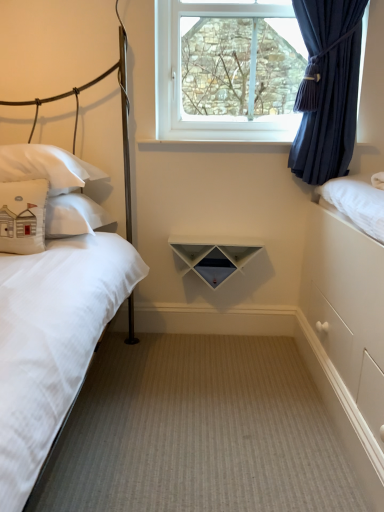
The height and width of the screenshot is (512, 384). What are the coordinates of `white matte triangle at center` in the screenshot? It's located at (214, 256).

What is the approximate width of white matte bed at left?

The width of white matte bed at left is 5.27 feet.

Describe the element at coordinates (46, 167) in the screenshot. I see `white cotton pillow at left, marked as the first pillow in a back-to-front arrangement` at that location.

Image resolution: width=384 pixels, height=512 pixels. Find the location of `navy blue sheer curtain at upper right`. navy blue sheer curtain at upper right is located at coordinates (327, 88).

Measure the distance between beige fabric pillow at left, which is the first pillow in front-to-back order, and camera.

The depth of beige fabric pillow at left, which is the first pillow in front-to-back order, is 1.44 meters.

The width and height of the screenshot is (384, 512). What are the coordinates of `beige fabric pillow at left, which is the first pillow in front-to-back order` in the screenshot? It's located at (23, 216).

Image resolution: width=384 pixels, height=512 pixels. Describe the element at coordinates (227, 70) in the screenshot. I see `clear glass window at upper center` at that location.

At what (x,y) coordinates should I click in order to perform the action: click on white matte triangle at center. Please return your answer as a coordinate pair (x, y). This screenshot has width=384, height=512. Looking at the image, I should click on (214, 256).

Considering the positions of points (109, 403) and (336, 137), is point (109, 403) farther from camera compared to point (336, 137)?

That is False.

In the image, is beige carpet at center positioned in front of or behind navy blue sheer curtain at upper right?

In the image, beige carpet at center appears in front of navy blue sheer curtain at upper right.

In the scene shown: Would you consider beige carpet at center to be distant from navy blue sheer curtain at upper right?

Indeed, beige carpet at center is not near navy blue sheer curtain at upper right.

Image resolution: width=384 pixels, height=512 pixels. Find the location of `plain located below the navy blue sheer curtain at upper right (from the image's perspective)`. plain located below the navy blue sheer curtain at upper right (from the image's perspective) is located at coordinates (198, 432).

From the image's perspective, relative to beige fabric pillow at left, which is the first pillow in front-to-back order, is beige carpet at center above or below?

From the image's perspective, beige carpet at center appears below beige fabric pillow at left, which is the first pillow in front-to-back order.

Is beige carpet at center further to the viewer compared to beige fabric pillow at left, the second pillow positioned from the back?

That is False.

Considering the positions of points (183, 464) and (21, 190), is point (183, 464) closer to camera compared to point (21, 190)?

That is True.

From a real-world perspective, does beige carpet at center stand above beige fabric pillow at left, the second pillow positioned from the back?

No.

How much distance is there between beige carpet at center and white cotton pillow at left, marked as the first pillow in a back-to-front arrangement?

They are 37.44 inches apart.

Identify the location of plain that appears in front of the white cotton pillow at left, marked as the first pillow in a back-to-front arrangement. The image size is (384, 512). (198, 432).

Is beige carpet at center positioned before white cotton pillow at left, arranged as the 2th pillow when viewed from the front?

Yes, the depth of beige carpet at center is less than that of white cotton pillow at left, arranged as the 2th pillow when viewed from the front.

Can you tell me how much beige carpet at center and white cotton pillow at left, marked as the first pillow in a back-to-front arrangement, differ in facing direction?

beige carpet at center and white cotton pillow at left, marked as the first pillow in a back-to-front arrangement, are facing 0.429 degrees away from each other.

Based on the photo, is beige fabric pillow at left, the second pillow positioned from the back, at the right side of navy blue sheer curtain at upper right?

Incorrect, beige fabric pillow at left, the second pillow positioned from the back, is not on the right side of navy blue sheer curtain at upper right.

Considering the relative sizes of beige fabric pillow at left, which is the first pillow in front-to-back order, and navy blue sheer curtain at upper right in the image provided, is beige fabric pillow at left, which is the first pillow in front-to-back order, shorter than navy blue sheer curtain at upper right?

Indeed, beige fabric pillow at left, which is the first pillow in front-to-back order, has a lesser height compared to navy blue sheer curtain at upper right.

Is beige fabric pillow at left, the second pillow positioned from the back, bigger than navy blue sheer curtain at upper right?

A: Actually, beige fabric pillow at left, the second pillow positioned from the back, might be smaller than navy blue sheer curtain at upper right.

How far apart are beige fabric pillow at left, the second pillow positioned from the back, and navy blue sheer curtain at upper right?

beige fabric pillow at left, the second pillow positioned from the back, and navy blue sheer curtain at upper right are 3.91 feet apart.

Can you tell me how much navy blue sheer curtain at upper right and clear glass window at upper center differ in facing direction?

They differ by 1.7 degrees in their facing directions.

Considering the sizes of navy blue sheer curtain at upper right and clear glass window at upper center in the image, is navy blue sheer curtain at upper right bigger or smaller than clear glass window at upper center?

Considering their sizes, navy blue sheer curtain at upper right takes up more space than clear glass window at upper center.

Is navy blue sheer curtain at upper right behind clear glass window at upper center?

No, the depth of navy blue sheer curtain at upper right is less than that of clear glass window at upper center.

Based on the photo, is navy blue sheer curtain at upper right wider than clear glass window at upper center?

Indeed, navy blue sheer curtain at upper right has a greater width compared to clear glass window at upper center.

Can you confirm if white cotton pillow at left, marked as the first pillow in a back-to-front arrangement, is smaller than white matte bed at left?

Correct, white cotton pillow at left, marked as the first pillow in a back-to-front arrangement, occupies less space than white matte bed at left.

From a real-world perspective, is white cotton pillow at left, marked as the first pillow in a back-to-front arrangement, on white matte bed at left?

Yes, from a real-world perspective, white cotton pillow at left, marked as the first pillow in a back-to-front arrangement, is over white matte bed at left

Is white cotton pillow at left, arranged as the 2th pillow when viewed from the front, shorter than white matte bed at left?

Indeed, white cotton pillow at left, arranged as the 2th pillow when viewed from the front, has a lesser height compared to white matte bed at left.

Which is more to the right, white cotton pillow at left, marked as the first pillow in a back-to-front arrangement, or white matte bed at left?

white matte bed at left.

Is point (293, 132) closer to viewer compared to point (13, 148)?

No, (293, 132) is further to viewer.

From the picture: Visually, is clear glass window at upper center positioned to the left or to the right of white cotton pillow at left, marked as the first pillow in a back-to-front arrangement?

In the image, clear glass window at upper center appears on the right side of white cotton pillow at left, marked as the first pillow in a back-to-front arrangement.

In terms of width, does clear glass window at upper center look wider or thinner when compared to white cotton pillow at left, marked as the first pillow in a back-to-front arrangement?

Clearly, clear glass window at upper center has less width compared to white cotton pillow at left, marked as the first pillow in a back-to-front arrangement.

From the image's perspective, is clear glass window at upper center beneath white cotton pillow at left, marked as the first pillow in a back-to-front arrangement?

No, from the image's perspective, clear glass window at upper center is not below white cotton pillow at left, marked as the first pillow in a back-to-front arrangement.

The height and width of the screenshot is (512, 384). What are the coordinates of `plain on the left of navy blue sheer curtain at upper right` in the screenshot? It's located at (198, 432).

The image size is (384, 512). Identify the location of the 1st pillow positioned above the beige carpet at center (from a real-world perspective). (23, 216).

Estimate the real-world distances between objects in this image. Which object is closer to navy blue sheer curtain at upper right, clear glass window at upper center or white matte bed at left?

clear glass window at upper center.

Which object lies nearer to the anchor point beige carpet at center, white cotton pillow at left, marked as the first pillow in a back-to-front arrangement, or navy blue sheer curtain at upper right?

white cotton pillow at left, marked as the first pillow in a back-to-front arrangement.

Which object lies nearer to the anchor point white matte triangle at center, beige carpet at center or white matte bed at left?

Among the two, white matte bed at left is located nearer to white matte triangle at center.

Considering their positions, is beige carpet at center positioned further to clear glass window at upper center than white matte bed at left?

beige carpet at center lies further to clear glass window at upper center than the other object.

When comparing their distances from white matte bed at left, does beige carpet at center or navy blue sheer curtain at upper right seem closer?

The object closer to white matte bed at left is beige carpet at center.

Which object lies further to the anchor point white matte bed at left, white matte triangle at center or beige fabric pillow at left, the second pillow positioned from the back?

The object further to white matte bed at left is white matte triangle at center.

Based on their spatial positions, is white cotton pillow at left, marked as the first pillow in a back-to-front arrangement, or beige fabric pillow at left, which is the first pillow in front-to-back order, further from clear glass window at upper center?

Among the two, beige fabric pillow at left, which is the first pillow in front-to-back order, is located further to clear glass window at upper center.

Which object lies nearer to the anchor point white matte triangle at center, navy blue sheer curtain at upper right or clear glass window at upper center?

Among the two, navy blue sheer curtain at upper right is located nearer to white matte triangle at center.

Where is `curtain that lies between clear glass window at upper center and white matte triangle at center from top to bottom`? The width and height of the screenshot is (384, 512). curtain that lies between clear glass window at upper center and white matte triangle at center from top to bottom is located at coordinates (327, 88).

You are a GUI agent. You are given a task and a screenshot of the screen. Output one action in this format:
    pyautogui.click(x=<x>, y=<y>)
    Task: Click on the plain between white matte bed at left and beige fabric pillow at left, the second pillow positioned from the back, in the front-back direction
    This screenshot has width=384, height=512.
    Given the screenshot: What is the action you would take?
    pyautogui.click(x=198, y=432)

At what (x,y) coordinates should I click in order to perform the action: click on shelf between beige fabric pillow at left, the second pillow positioned from the back, and navy blue sheer curtain at upper right, in the horizontal direction. Please return your answer as a coordinate pair (x, y). The image size is (384, 512). Looking at the image, I should click on (214, 256).

You are a GUI agent. You are given a task and a screenshot of the screen. Output one action in this format:
    pyautogui.click(x=<x>, y=<y>)
    Task: Click on the pillow situated between beige fabric pillow at left, which is the first pillow in front-to-back order, and white matte triangle at center from left to right
    
    Given the screenshot: What is the action you would take?
    pyautogui.click(x=46, y=167)